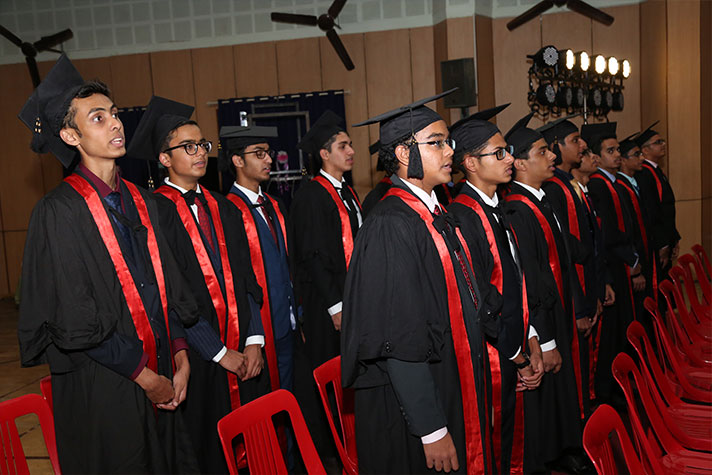
Image resolution: width=712 pixels, height=475 pixels. What are the coordinates of `whit  tiling` in the screenshot? It's located at tap(82, 35), tap(201, 27).